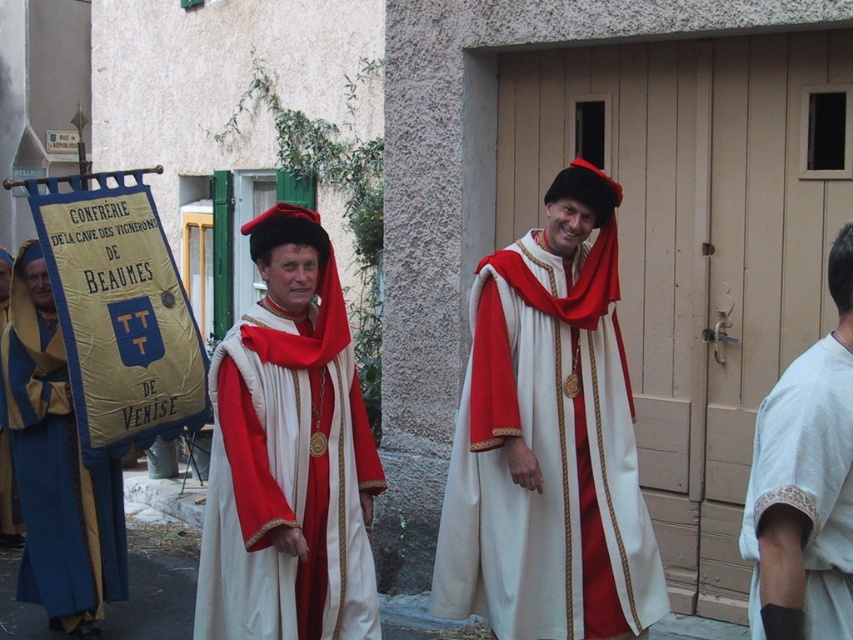
Is matte white robe at center above matte red velvet hat at center?

Yes, matte white robe at center is above matte red velvet hat at center.

Which is behind, point (628, 429) or point (239, 497)?

The point (628, 429) is behind.

Find the location of `matte white robe at center`. matte white robe at center is located at coordinates (549, 440).

Which is behind, point (624, 380) or point (62, 536)?

The point (62, 536) is behind.

Describe the element at coordinates (549, 440) in the screenshot. I see `matte white robe at center` at that location.

You are a GUI agent. You are given a task and a screenshot of the screen. Output one action in this format:
    pyautogui.click(x=<x>, y=<y>)
    Task: Click on the matte white robe at center
    This screenshot has width=853, height=640.
    Given the screenshot: What is the action you would take?
    pyautogui.click(x=549, y=440)

Who is lower down, matte red velvet hat at center or white cotton shirt at right?

matte red velvet hat at center

Which of these two, matte red velvet hat at center or white cotton shirt at right, stands taller?

matte red velvet hat at center

Which is in front, point (364, 630) or point (849, 250)?

Point (849, 250) is in front.

I want to click on matte red velvet hat at center, so click(x=288, y=456).